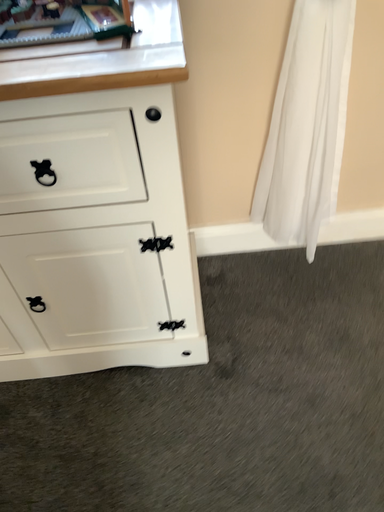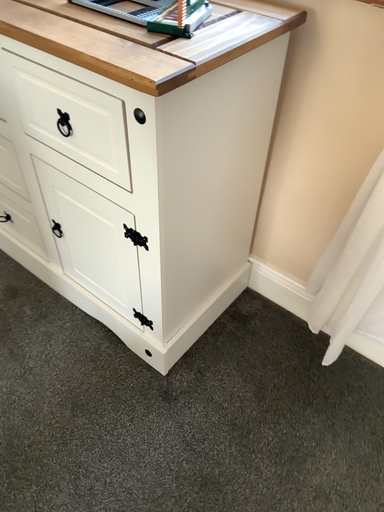
Question: Which way did the camera rotate in the video?

Choices:
 (A) rotated upward
 (B) rotated downward

Answer: (A)